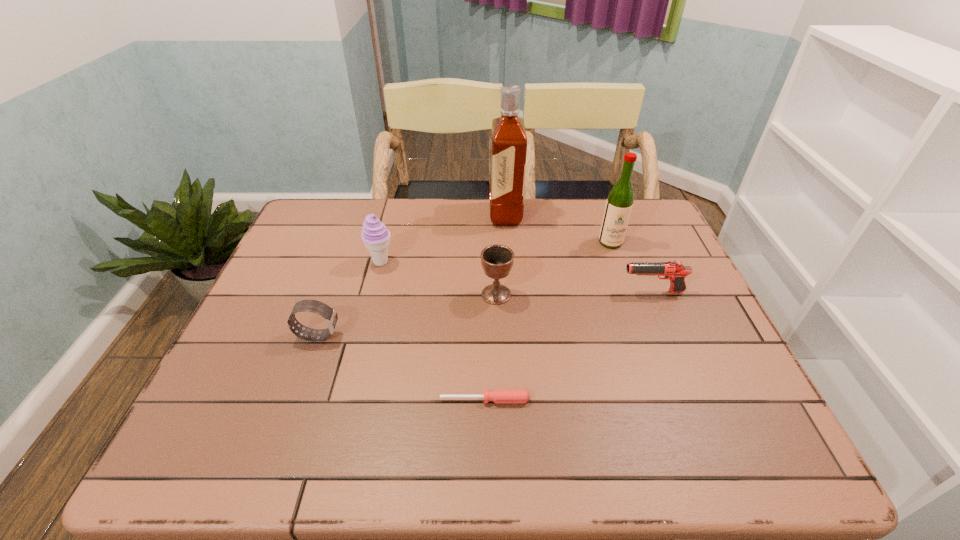
The height and width of the screenshot is (540, 960). Identify the location of vacant area at the right edge of the desktop. (739, 383).

Locate an element on the screen. This screenshot has width=960, height=540. vacant space at the far right corner of the desktop is located at coordinates (636, 209).

The image size is (960, 540). Find the location of `free space that is in between the third farthest object and the nearest object`. free space that is in between the third farthest object and the nearest object is located at coordinates (433, 331).

Locate an element on the screen. free space between the gun and the nearest object is located at coordinates (568, 346).

Where is `vacant area that lies between the nearest object and the nearer liquor`? The image size is (960, 540). vacant area that lies between the nearest object and the nearer liquor is located at coordinates (547, 321).

I want to click on free point between the sixth farthest object and the chalice, so click(x=407, y=315).

The height and width of the screenshot is (540, 960). Identify the location of vacant space in between the third farthest object and the taller liquor. (443, 239).

The height and width of the screenshot is (540, 960). What are the coordinates of `free space between the watch and the chalice` in the screenshot? It's located at (407, 315).

Locate which object is the second closest to the fifth shortest object. Please provide its 2D coordinates. Your answer should be formatted as a tuple, i.e. [(x, y)], where the tuple contains the x and y coordinates of a point satisfying the conditions above.

[(497, 260)]

Find the location of a particular element. object identified as the sixth closest to the third tallest object is located at coordinates (674, 270).